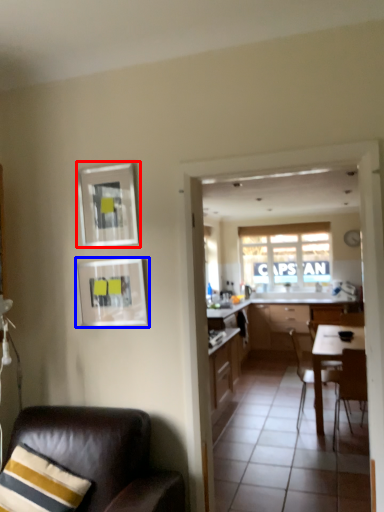
Question: Which of the following is the farthest to the observer, picture frame (highlighted by a red box) or picture frame (highlighted by a blue box)?

Choices:
 (A) picture frame
 (B) picture frame

Answer: (A)